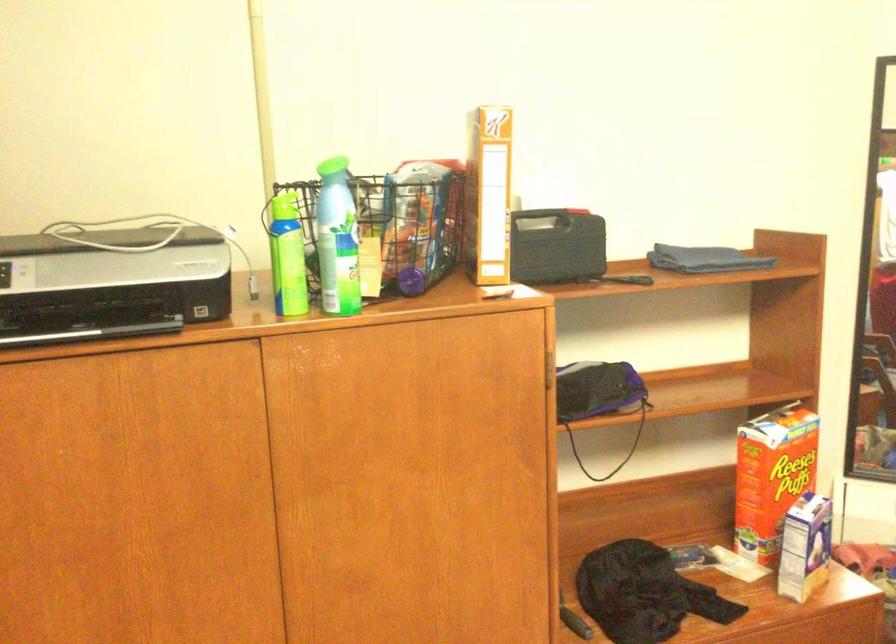
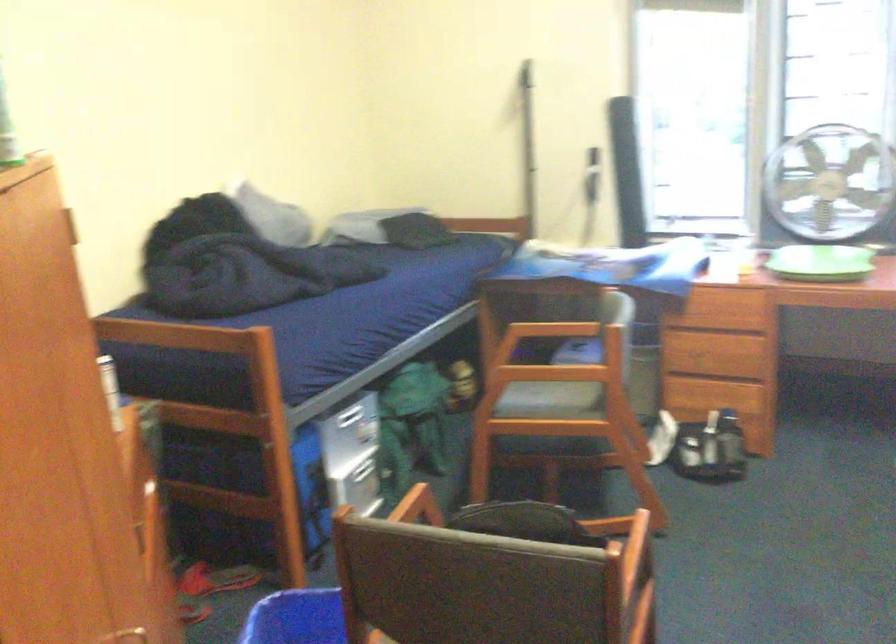
Question: I am providing you with two images of the same scene from different viewpoints. After the viewpoint changes to image2, which objects are now occluded?

Choices:
 (A) gray chair seat
 (B) wooden chair armrest
 (C) small milk carton
 (D) yellow dispenser bottle

Answer: (C)